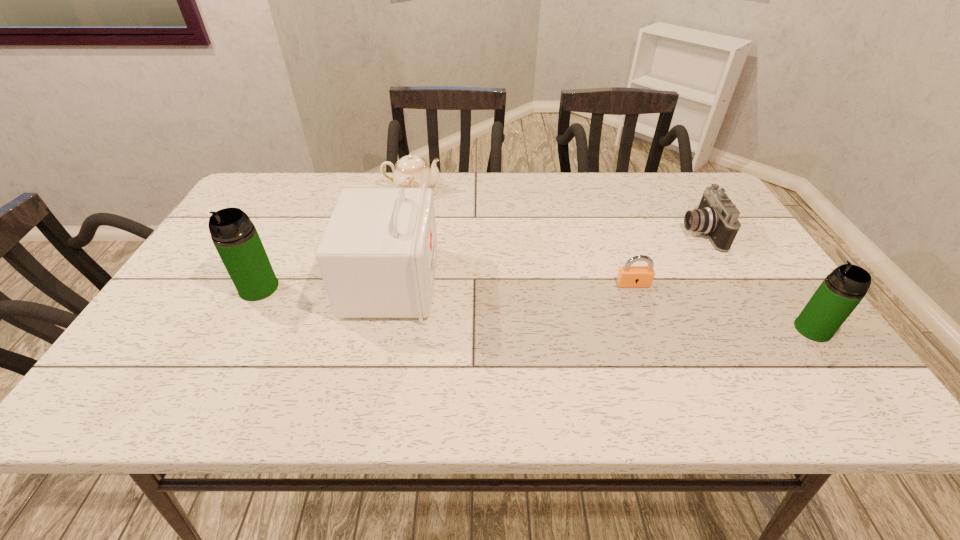
Identify the location of free location at the right edge. This screenshot has width=960, height=540. (721, 277).

At what (x,y) coordinates should I click in order to perform the action: click on vacant space at the far left corner of the desktop. Please return your answer as a coordinate pair (x, y). The height and width of the screenshot is (540, 960). Looking at the image, I should click on (273, 180).

The width and height of the screenshot is (960, 540). In order to click on vacant region at the far right corner of the desktop in this screenshot , I will do `click(694, 176)`.

You are a GUI agent. You are given a task and a screenshot of the screen. Output one action in this format:
    pyautogui.click(x=<x>, y=<y>)
    Task: Click on the free space between the left thermos bottle and the rightmost object
    
    Given the screenshot: What is the action you would take?
    pyautogui.click(x=536, y=309)

At what (x,y) coordinates should I click in order to perform the action: click on vacant area between the camera and the chinaware. Please return your answer as a coordinate pair (x, y). This screenshot has height=540, width=960. Looking at the image, I should click on (557, 211).

Where is `vacant space in between the farther thermos bottle and the second object from right to left`? The width and height of the screenshot is (960, 540). vacant space in between the farther thermos bottle and the second object from right to left is located at coordinates (480, 260).

Identify the location of empty space that is in between the rightmost object and the padlock. (723, 307).

Image resolution: width=960 pixels, height=540 pixels. What are the coordinates of `free space between the right thermos bottle and the shortest object` in the screenshot? It's located at (723, 307).

Find the location of a particular element. The width and height of the screenshot is (960, 540). object that can be found as the second closest to the fifth object from left to right is located at coordinates (842, 290).

The image size is (960, 540). Find the location of `object that is the fifth nearest to the first-aid kit`. object that is the fifth nearest to the first-aid kit is located at coordinates (842, 290).